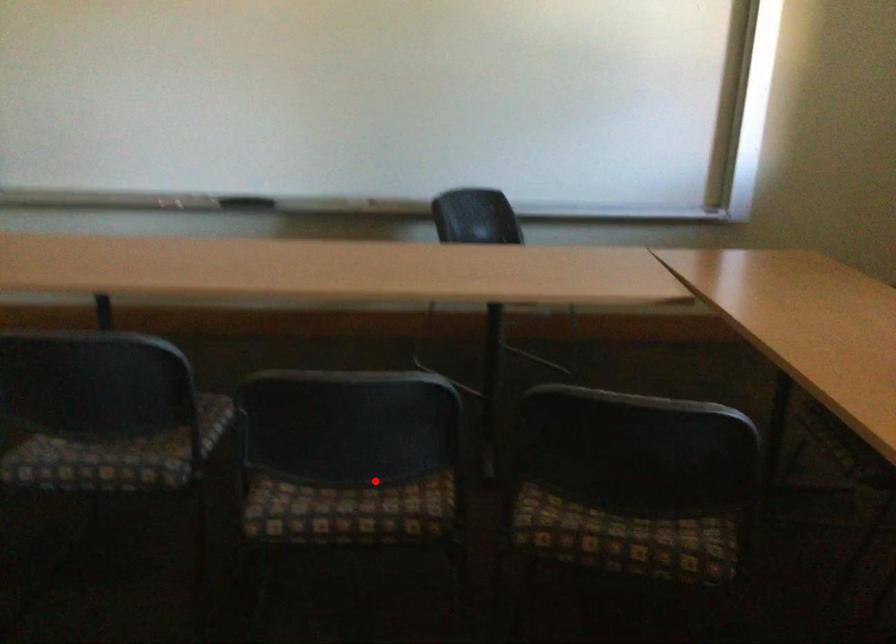
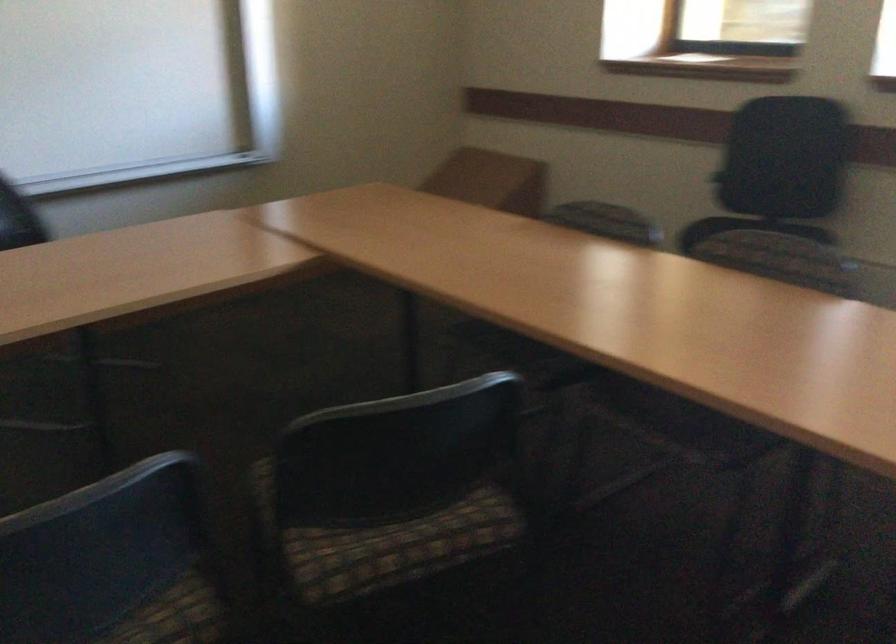
Question: I am providing you with two images of the same scene from different viewpoints. In image1, a red point is highlighted. Considering the same 3D point in image2, which of the following is correct?

Choices:
 (A) It is closer
 (B) It is farther

Answer: (A)